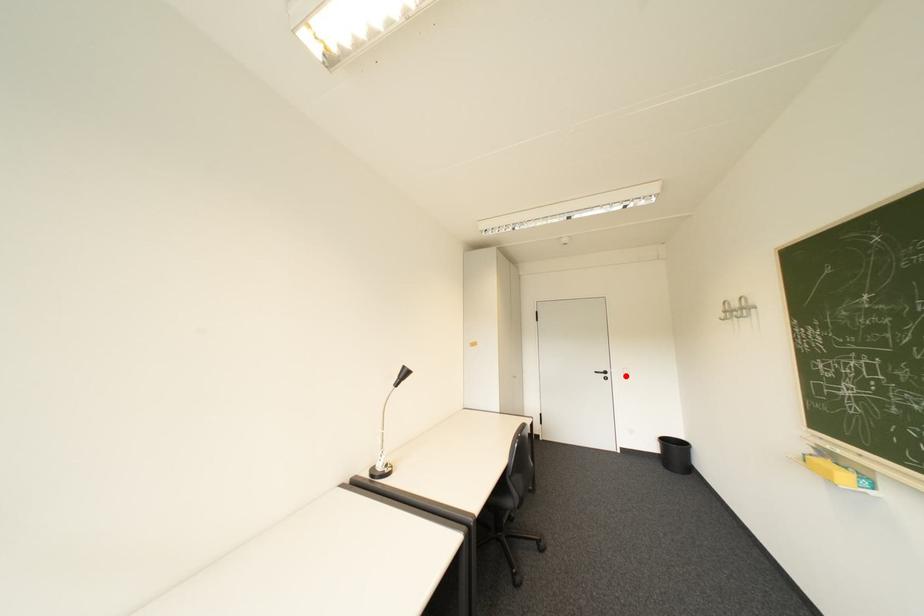
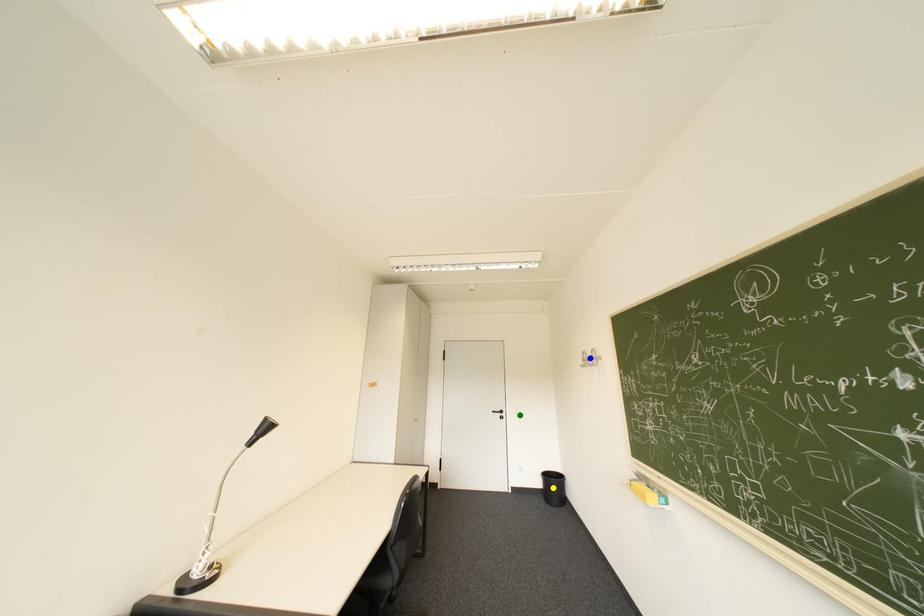
Question: I am providing you with two images of the same scene from different viewpoints. A red point is marked on the first image. You are given multiple points on the second image. Which point in image 2 is actually the same real-world point as the red point in image 1?

Choices:
 (A) green point
 (B) yellow point
 (C) blue point

Answer: (A)